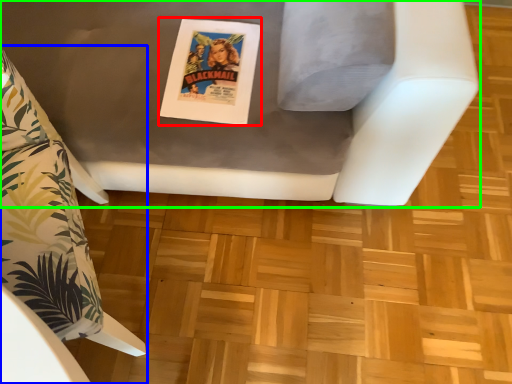
Question: Based on their relative distances, which object is farther from comic book (highlighted by a red box)? Choose from furniture (highlighted by a blue box) and furniture (highlighted by a green box).

Choices:
 (A) furniture
 (B) furniture

Answer: (A)